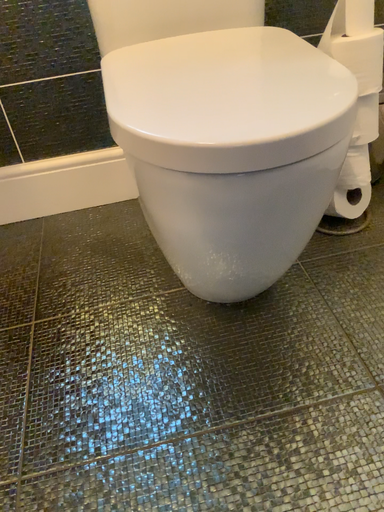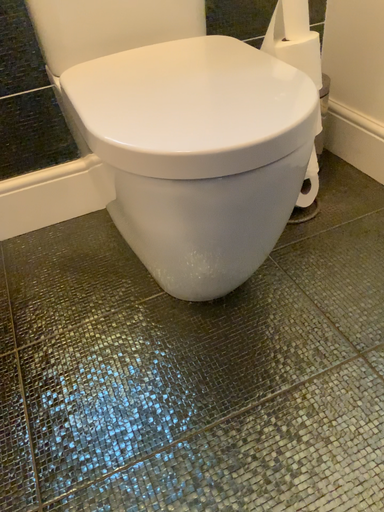
Question: Which way did the camera rotate in the video?

Choices:
 (A) rotated right
 (B) rotated left

Answer: (A)